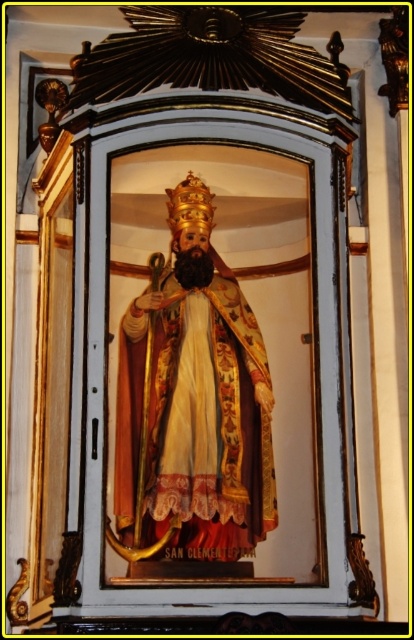
You are standing in front of the religious statue and want to take a photo of the point at coordinates point (156, 540). If your camera has a maximum focus range of 70 meters, will you be able to focus on that point?

The distance of point (156, 540) from the viewer is 74.42 meters, which exceeds the camera maximum focus range of 70 meters. Therefore, the camera cannot focus on that point.